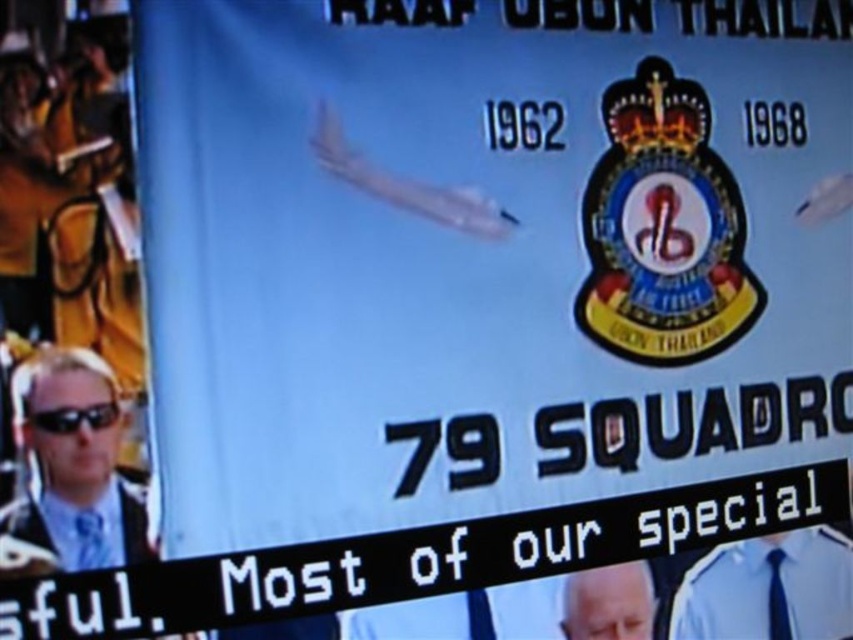
You are a character in a video game and need to decide which item to pick up first. You see a blue shirt at center and a black plastic goggles at lower left. Which item takes up more space?

The blue shirt at center is bigger than black plastic goggles at lower left, so the blue shirt at center takes up more space.

You are a photographer taking a picture of the blue shirt at center and the black plastic goggles at lower left. Which object will appear larger in the photo?

The blue shirt at center will appear larger in the photo because it is closer to the viewer than the black plastic goggles at lower left.

You are a photographer who needs to capture a clear photo of the gray hair at center and the blue fabric tie at lower left for an identification document. The minimum distance between the two objects in the photo must be at least 36 inches to meet the requirement. Based on the scene description, will the current positioning allow you to meet this requirement?

The gray hair at center and the blue fabric tie at lower left are 34.95 inches apart, which is less than the required 36 inches. Therefore, the current positioning does not meet the requirement.